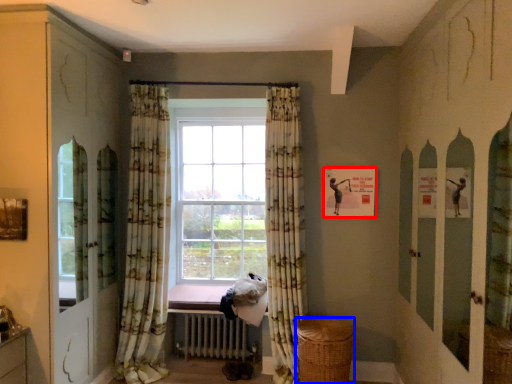
Question: Which point is further to the camera, picture frame (highlighted by a red box) or basket (highlighted by a blue box)?

Choices:
 (A) picture frame
 (B) basket

Answer: (A)